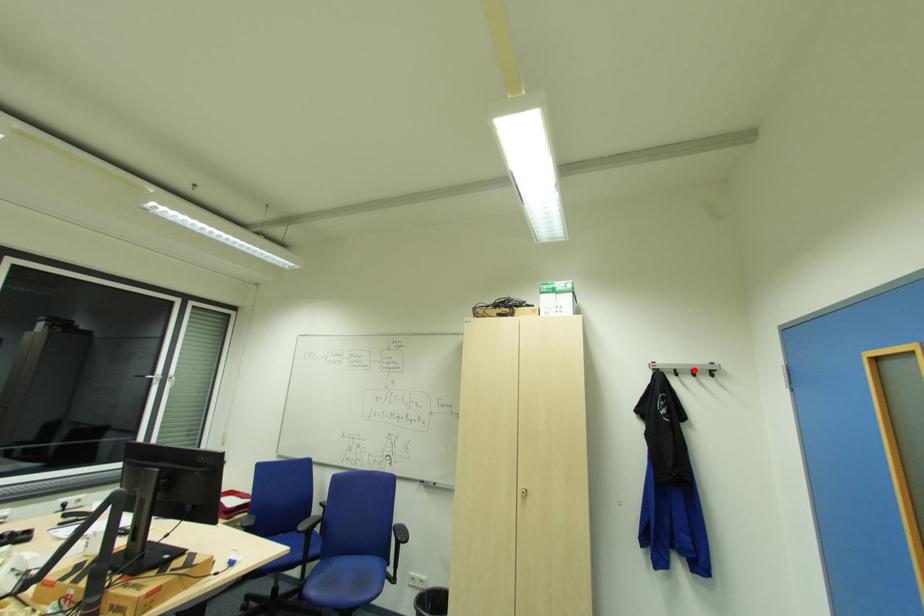
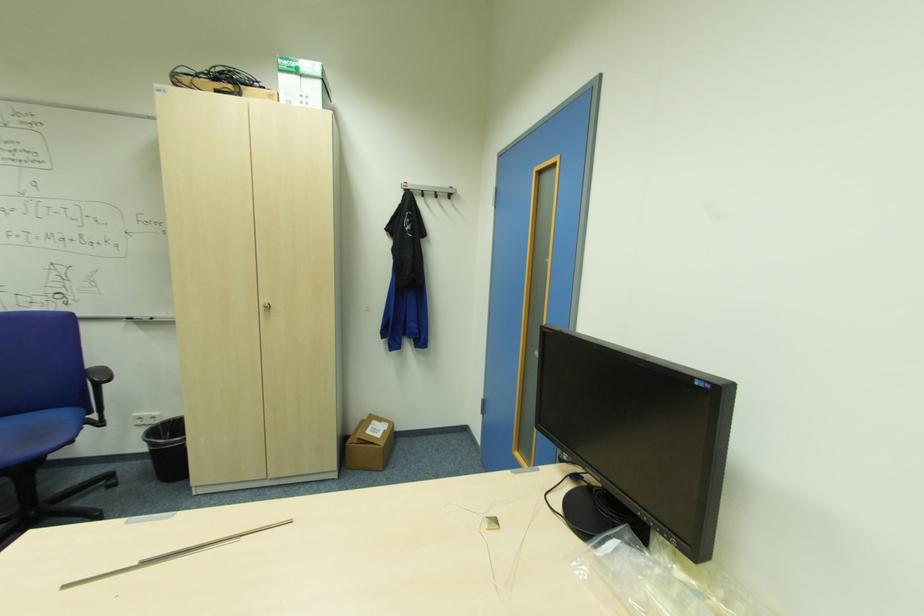
Where in the second image is the point corresponding to the highlighted location from the first image?

(439, 192)